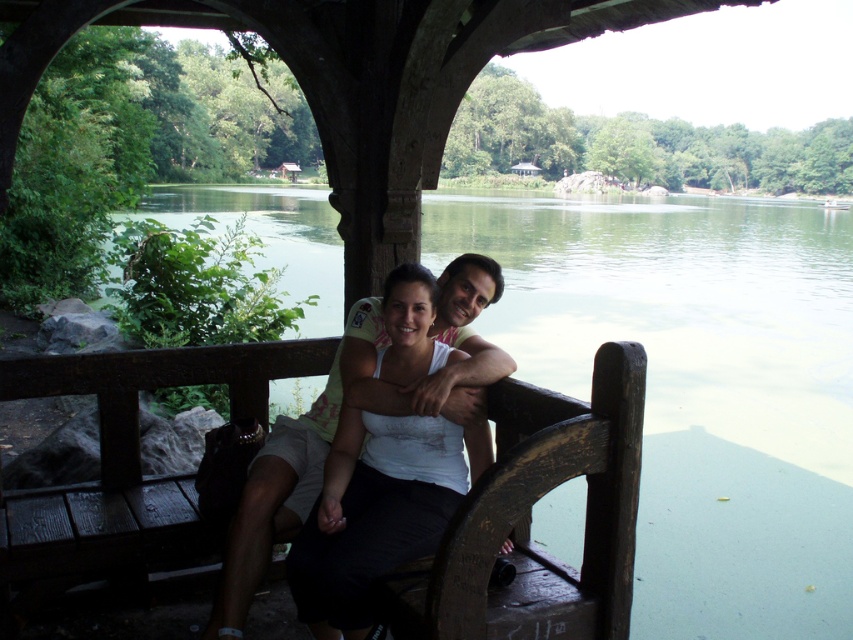
Which is behind, point (317, 362) or point (347, 612)?

The point (317, 362) is more distant.

Between wooden bench at center and white matte tank top at center, which one appears on the left side from the viewer's perspective?

wooden bench at center is more to the left.

What do you see at coordinates (537, 499) in the screenshot?
I see `wooden bench at center` at bounding box center [537, 499].

This screenshot has width=853, height=640. What are the coordinates of `wooden bench at center` in the screenshot? It's located at (537, 499).